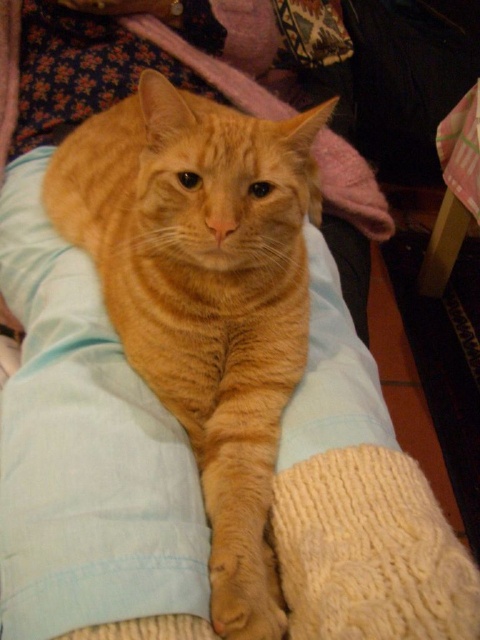
Which is in front, point (172, 204) or point (179, 433)?

Positioned in front is point (172, 204).

This screenshot has height=640, width=480. In order to click on orange fur cat at center in this screenshot , I will do `click(204, 296)`.